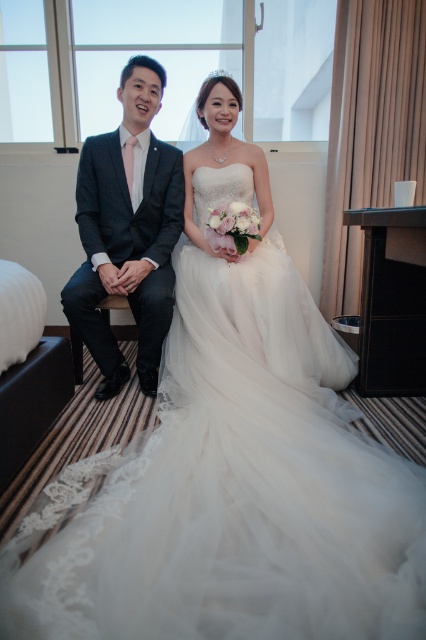
Question: Is white tulle dress at center bigger than white lace dress at center?

Choices:
 (A) no
 (B) yes

Answer: (B)

Question: Which point appears closest to the camera in this image?

Choices:
 (A) (204, 161)
 (B) (204, 269)
 (C) (132, 208)

Answer: (B)

Question: Which point appears closest to the camera in this image?

Choices:
 (A) (227, 132)
 (B) (181, 632)

Answer: (B)

Question: Does matte black suit at left appear over white lace dress at center?

Choices:
 (A) no
 (B) yes

Answer: (A)

Question: Can you confirm if matte black suit at left is positioned to the left of white lace dress at center?

Choices:
 (A) yes
 (B) no

Answer: (A)

Question: Which object is closer to the camera taking this photo?

Choices:
 (A) white lace dress at center
 (B) white tulle dress at center

Answer: (B)